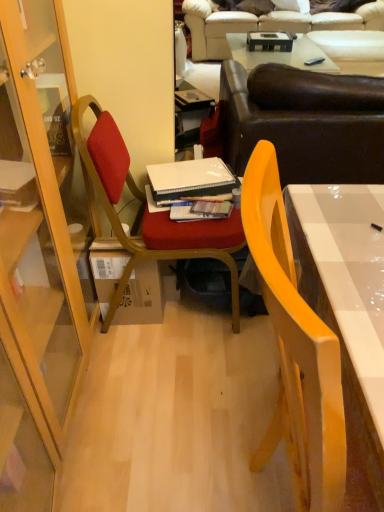
Question: Does beige leather couch at upper center, the first studio couch positioned from the back, turn towards white matte notebook at center, the 1th book from the back?

Choices:
 (A) yes
 (B) no

Answer: (A)

Question: Considering the relative positions of beige leather couch at upper center, marked as the second studio couch in a bottom-to-top arrangement, and white matte notebook at center, the 1th book from the back, in the image provided, is beige leather couch at upper center, marked as the second studio couch in a bottom-to-top arrangement, behind white matte notebook at center, the 1th book from the back,?

Choices:
 (A) no
 (B) yes

Answer: (B)

Question: Is beige leather couch at upper center, the first studio couch positioned from the back, surrounding white matte notebook at center, the 1th book from the back?

Choices:
 (A) yes
 (B) no

Answer: (B)

Question: Can you confirm if beige leather couch at upper center, marked as the second studio couch in a bottom-to-top arrangement, is smaller than white matte notebook at center, the second book from the front?

Choices:
 (A) yes
 (B) no

Answer: (B)

Question: From a real-world perspective, does beige leather couch at upper center, which appears as the second studio couch when viewed from the front, stand above white matte notebook at center, the second book from the front?

Choices:
 (A) no
 (B) yes

Answer: (A)

Question: Does point (216, 217) appear closer or farther from the camera than point (155, 204)?

Choices:
 (A) farther
 (B) closer

Answer: (B)

Question: From a real-world perspective, is hardcover book at center, positioned as the first book in front-to-back order, above or below white matte notebook at center, the second book from the front?

Choices:
 (A) above
 (B) below

Answer: (B)

Question: In terms of size, does hardcover book at center, positioned as the first book in front-to-back order, appear bigger or smaller than white matte notebook at center, the second book from the front?

Choices:
 (A) big
 (B) small

Answer: (B)

Question: Relative to white matte notebook at center, the 1th book from the back, is hardcover book at center, positioned as the first book in front-to-back order, in front or behind?

Choices:
 (A) behind
 (B) front

Answer: (B)

Question: From the image's perspective, is white matte notebook at center, the second book from the front, positioned above or below hardcover book at center, positioned as the first book in front-to-back order?

Choices:
 (A) above
 (B) below

Answer: (A)

Question: Is white matte notebook at center, the second book from the front, in front of or behind hardcover book at center, which is the 2th book from back to front, in the image?

Choices:
 (A) behind
 (B) front

Answer: (A)

Question: Is white matte notebook at center, the second book from the front, bigger or smaller than hardcover book at center, which is the 2th book from back to front?

Choices:
 (A) big
 (B) small

Answer: (A)

Question: Does point (211, 180) appear closer or farther from the camera than point (185, 202)?

Choices:
 (A) closer
 (B) farther

Answer: (B)

Question: Considering the positions of point (145, 236) and point (382, 30), is point (145, 236) closer or farther from the camera than point (382, 30)?

Choices:
 (A) farther
 (B) closer

Answer: (B)

Question: Considering the relative positions of velvet red chair at center, acting as the first chair starting from the back, and beige leather couch at upper center, the first studio couch positioned from the back, in the image provided, is velvet red chair at center, acting as the first chair starting from the back, to the left or to the right of beige leather couch at upper center, the first studio couch positioned from the back,?

Choices:
 (A) right
 (B) left

Answer: (B)